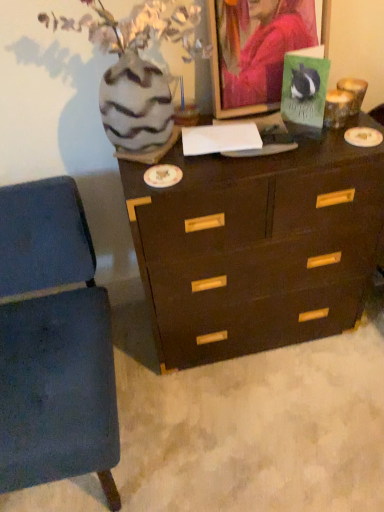
This screenshot has width=384, height=512. In order to click on free point in front of green matte postcard at upper right in this screenshot , I will do `click(327, 151)`.